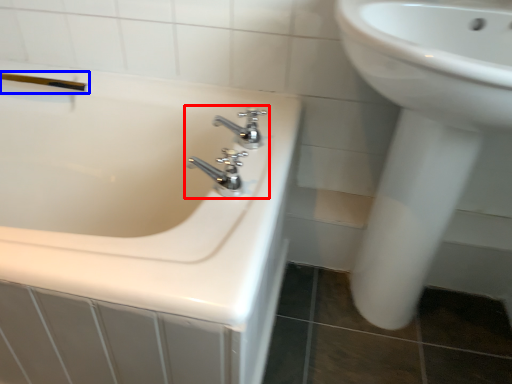
Question: Which point is further to the camera, tap (highlighted by a red box) or shower (highlighted by a blue box)?

Choices:
 (A) tap
 (B) shower

Answer: (B)